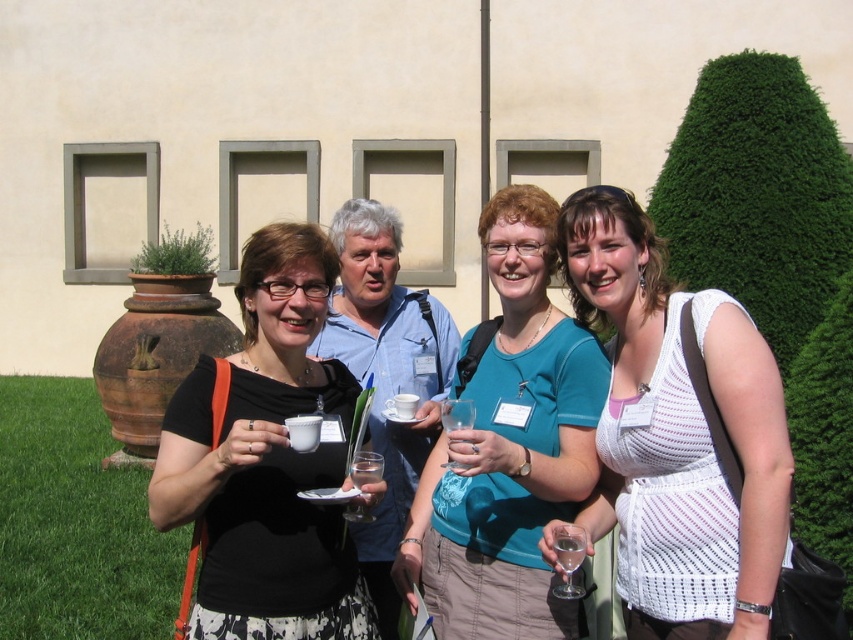
What are the coordinates of the white knitted tank top at center?

The white knitted tank top at center is located at point (677, 436).

You are at a garden party and see two drinks in front of you. You want to choose the taller one. Which one should you pick between the black matte cup at center and the transparent glass at lower right?

The black matte cup at center is taller than the transparent glass at lower right, so you should pick the black matte cup at center.